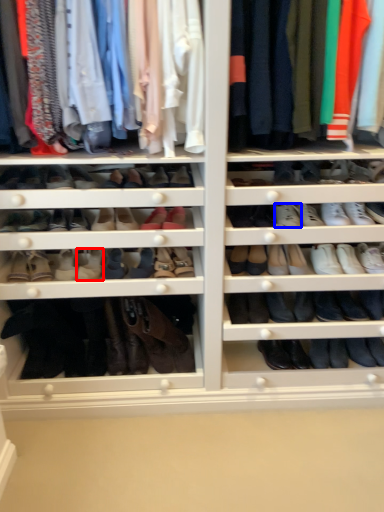
Question: Which point is closer to the camera, shoe (highlighted by a red box) or shoe (highlighted by a blue box)?

Choices:
 (A) shoe
 (B) shoe

Answer: (B)